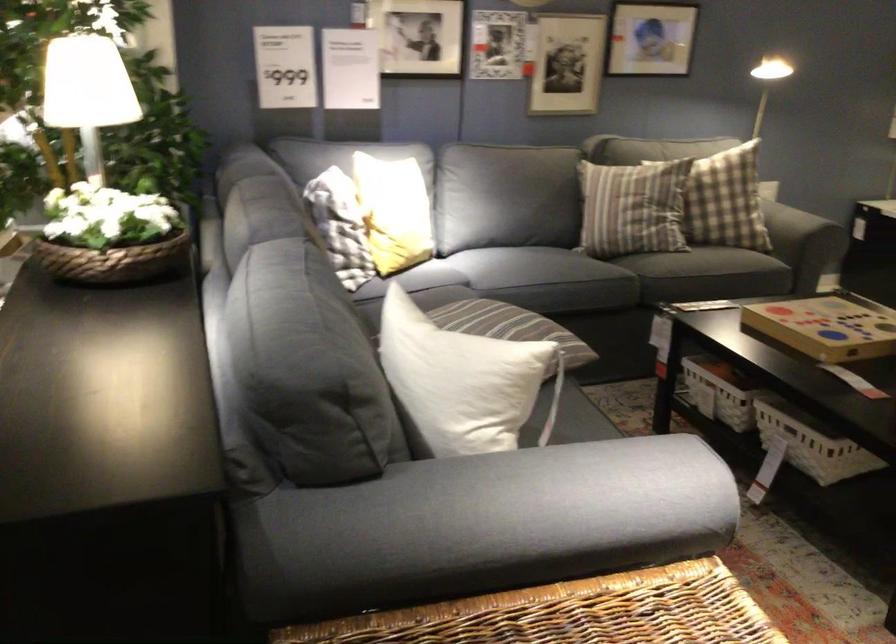
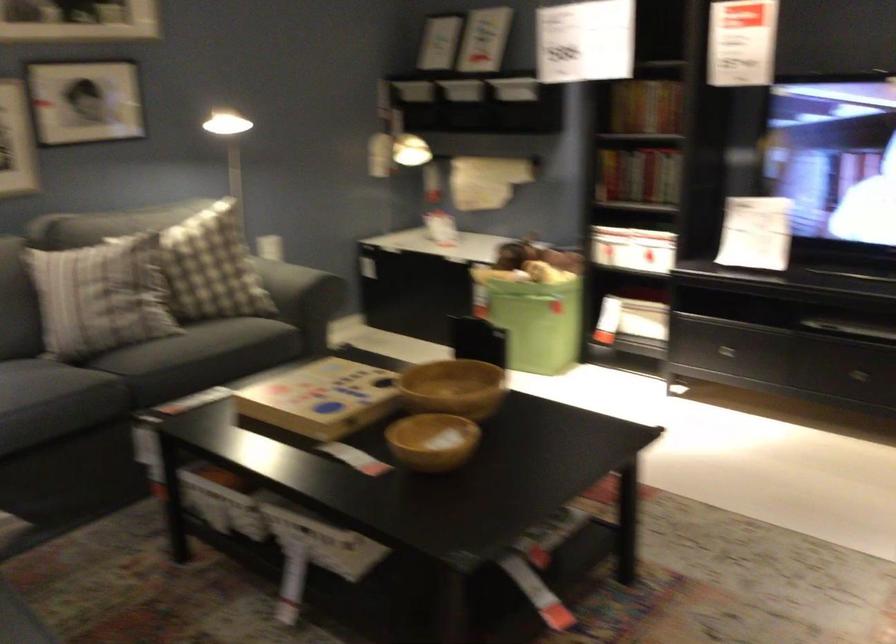
Where in the second image is the point corresponding to point 722,266 from the first image?

(199, 357)